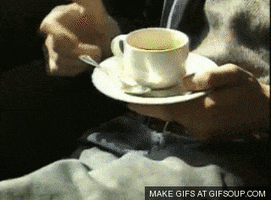
This screenshot has height=200, width=271. What are the coordinates of `white saucer` in the screenshot? It's located at (161, 99).